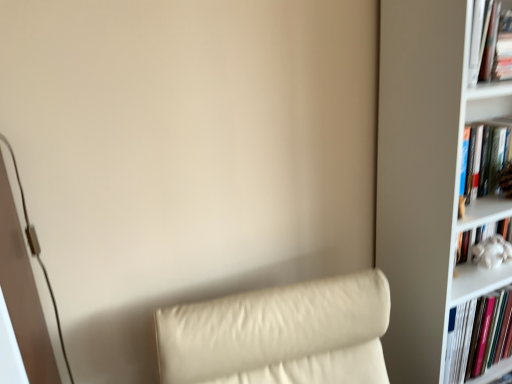
Question: Could you tell me if white matte bookcase at right is turned towards hardcover book at right, the 4th book from the top?

Choices:
 (A) no
 (B) yes

Answer: (B)

Question: Is white matte bookcase at right smaller than hardcover book at right, the 4th book from the top?

Choices:
 (A) yes
 (B) no

Answer: (B)

Question: From the image's perspective, is white matte bookcase at right under hardcover book at right, the 1th book in the bottom-to-top sequence?

Choices:
 (A) no
 (B) yes

Answer: (A)

Question: Is white matte bookcase at right at the right side of hardcover book at right, the 1th book in the bottom-to-top sequence?

Choices:
 (A) yes
 (B) no

Answer: (A)

Question: Considering the relative sizes of white matte bookcase at right and hardcover book at right, the 4th book from the top, in the image provided, is white matte bookcase at right thinner than hardcover book at right, the 4th book from the top,?

Choices:
 (A) yes
 (B) no

Answer: (B)

Question: From the image's perspective, is hardcover book at right, the 4th book from the top, above or below white fluffy toy at right, the third book from the top?

Choices:
 (A) above
 (B) below

Answer: (B)

Question: In terms of width, does hardcover book at right, the 1th book in the bottom-to-top sequence, look wider or thinner when compared to white fluffy toy at right, the second book positioned from the bottom?

Choices:
 (A) thin
 (B) wide

Answer: (B)

Question: From a real-world perspective, relative to white fluffy toy at right, the third book from the top, is hardcover book at right, the 4th book from the top, vertically above or below?

Choices:
 (A) below
 (B) above

Answer: (A)

Question: Is point (506, 302) closer or farther from the camera than point (477, 258)?

Choices:
 (A) farther
 (B) closer

Answer: (A)

Question: Considering the relative positions of hardcover book at right, the second book positioned from the top, and white fluffy toy at right, the third book from the top, in the image provided, is hardcover book at right, the second book positioned from the top, to the left or to the right of white fluffy toy at right, the third book from the top,?

Choices:
 (A) right
 (B) left

Answer: (B)

Question: Is point (477, 183) closer or farther from the camera than point (503, 241)?

Choices:
 (A) closer
 (B) farther

Answer: (A)

Question: From a real-world perspective, is hardcover book at right, the second book positioned from the top, above or below white fluffy toy at right, the third book from the top?

Choices:
 (A) below
 (B) above

Answer: (B)

Question: Considering the positions of hardcover book at right, the second book positioned from the top, and white fluffy toy at right, the second book positioned from the bottom, in the image, is hardcover book at right, the second book positioned from the top, wider or thinner than white fluffy toy at right, the second book positioned from the bottom,?

Choices:
 (A) thin
 (B) wide

Answer: (A)

Question: Does point (486, 317) appear closer or farther from the camera than point (492, 18)?

Choices:
 (A) closer
 (B) farther

Answer: (B)

Question: From their relative heights in the image, would you say hardcover book at right, the 4th book from the top, is taller or shorter than hardcover book at upper right, marked as the first book in a top-to-bottom arrangement?

Choices:
 (A) short
 (B) tall

Answer: (B)